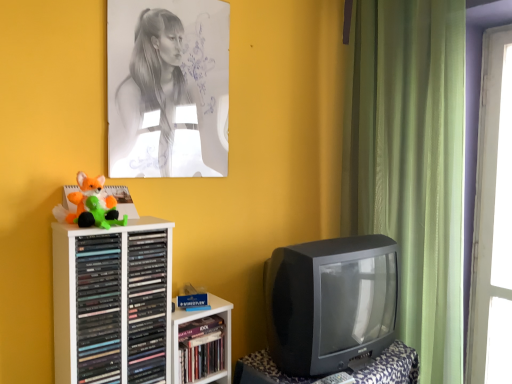
Question: From the image's perspective, is green plush toy at left, the 2th toy viewed from the top, over hardcover book at center, which ranks as the first book in right-to-left order?

Choices:
 (A) no
 (B) yes

Answer: (B)

Question: Is green plush toy at left, which ranks as the first toy in bottom-to-top order, thinner than hardcover book at center, which ranks as the first book in right-to-left order?

Choices:
 (A) yes
 (B) no

Answer: (A)

Question: Are green plush toy at left, which ranks as the first toy in bottom-to-top order, and hardcover book at center, which ranks as the first book in right-to-left order, located far from each other?

Choices:
 (A) no
 (B) yes

Answer: (A)

Question: Is green plush toy at left, the 2th toy viewed from the top, oriented away from hardcover book at center, acting as the 3th book starting from the left?

Choices:
 (A) no
 (B) yes

Answer: (A)

Question: Is green plush toy at left, which ranks as the first toy in bottom-to-top order, bigger than hardcover book at center, acting as the 3th book starting from the left?

Choices:
 (A) yes
 (B) no

Answer: (B)

Question: Is black plastic television at lower right wider or thinner than matte black books at left, placed as the first book when sorted from left to right?

Choices:
 (A) thin
 (B) wide

Answer: (B)

Question: From a real-world perspective, is black plastic television at lower right physically located above or below matte black books at left, placed as the first book when sorted from left to right?

Choices:
 (A) above
 (B) below

Answer: (B)

Question: Considering the positions of point (374, 382) and point (104, 329), is point (374, 382) closer or farther from the camera than point (104, 329)?

Choices:
 (A) farther
 (B) closer

Answer: (A)

Question: Choose the correct answer: Is black plastic television at lower right inside matte black books at left, which is the 3th book from right to left, or outside it?

Choices:
 (A) inside
 (B) outside

Answer: (B)

Question: Visually, is matte black books at left, placed as the first book when sorted from left to right, positioned to the left or to the right of black plastic television at right?

Choices:
 (A) right
 (B) left

Answer: (B)

Question: In the image, is matte black books at left, placed as the first book when sorted from left to right, positioned in front of or behind black plastic television at right?

Choices:
 (A) front
 (B) behind

Answer: (A)

Question: Does point (78, 284) appear closer or farther from the camera than point (297, 327)?

Choices:
 (A) closer
 (B) farther

Answer: (A)

Question: Would you say matte black books at left, placed as the first book when sorted from left to right, is inside or outside black plastic television at right?

Choices:
 (A) inside
 (B) outside

Answer: (B)

Question: Would you say green plush toy at left, which ranks as the first toy in bottom-to-top order, is inside or outside gray paper portrait at upper center?

Choices:
 (A) outside
 (B) inside

Answer: (A)

Question: Considering their positions, is green plush toy at left, which ranks as the first toy in bottom-to-top order, located in front of or behind gray paper portrait at upper center?

Choices:
 (A) front
 (B) behind

Answer: (A)